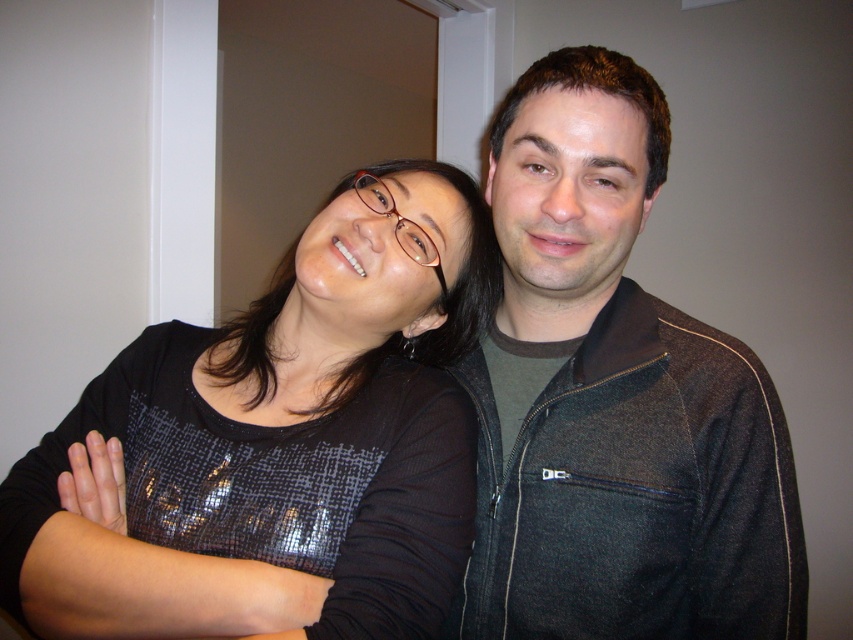
You are a photographer setting up a shoot in a studio. You need to place a spotlight above the black sequined top at center and another spotlight above the dark gray fleece jacket at center. Which spotlight should be placed higher to ensure both garments are properly illuminated?

The spotlight above the dark gray fleece jacket at center should be placed higher since the black sequined top at center is below the dark gray fleece jacket at center.

You are a photographer setting up for a group photo. You have a camera with a 5.5 inch wide lens. To ensure both the black sequined top at center and the dark gray fleece jacket at center are fully in frame, what is the minimum distance you need to stand away from them?

The minimum distance you need to stand away from the black sequened top at center and dark gray fleece jacket at center is 6.42 inches, as that is the distance between them and the camera lens must cover this space to include both in the frame.

In the scene shown: You are a fashion designer trying to create a new collection. You have two garments in front of you, the black sequined top at center and the dark gray fleece jacket at center. Which garment has a larger size?

The black sequined top at center is bigger than the dark gray fleece jacket at center, so the black sequined top at center has a larger size.